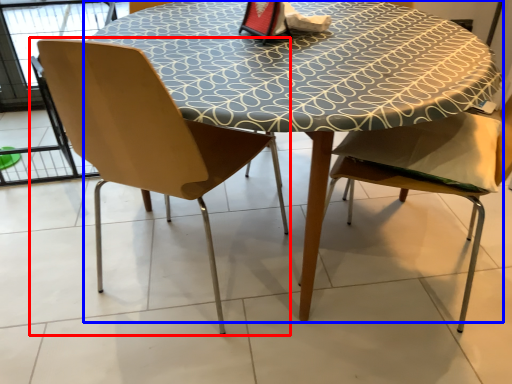
Question: Which object appears closest to the camera in this image, chair (highlighted by a red box) or table (highlighted by a blue box)?

Choices:
 (A) chair
 (B) table

Answer: (A)